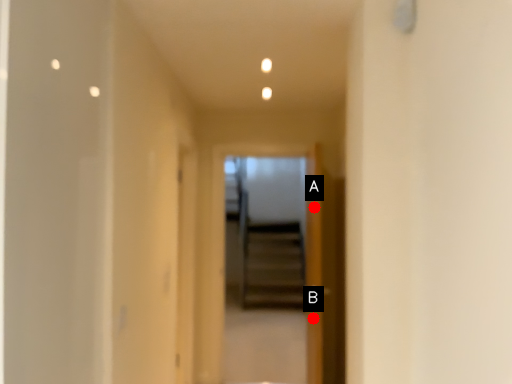
Question: Two points are circled on the image, labeled by A and B beside each circle. Which point is farther to the camera?

Choices:
 (A) A is further
 (B) B is further

Answer: (B)